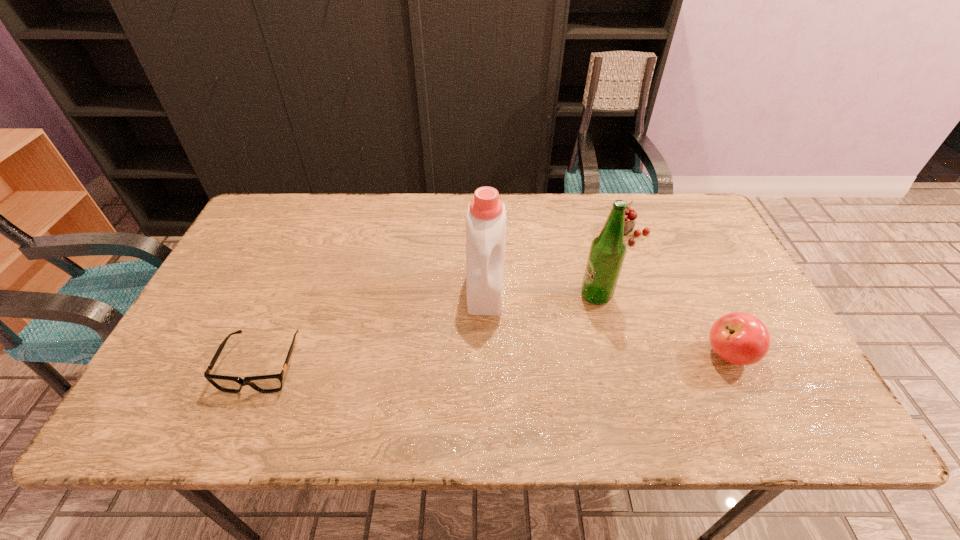
This screenshot has height=540, width=960. I want to click on the closest object to the leftmost object, so click(x=486, y=215).

Where is `free space that satisfies the following two spatial constraints: 1. on the front side of the apple; 2. on the right side of the third object from left to right`? The image size is (960, 540). free space that satisfies the following two spatial constraints: 1. on the front side of the apple; 2. on the right side of the third object from left to right is located at coordinates (611, 354).

The width and height of the screenshot is (960, 540). In order to click on vacant space that satisfies the following two spatial constraints: 1. on the front side of the second object from left to right; 2. on the right side of the third object from left to right in this screenshot , I will do `click(486, 296)`.

Locate an element on the screen. This screenshot has width=960, height=540. vacant space that satisfies the following two spatial constraints: 1. on the back side of the third object from left to right; 2. on the right side of the farthest object is located at coordinates (580, 233).